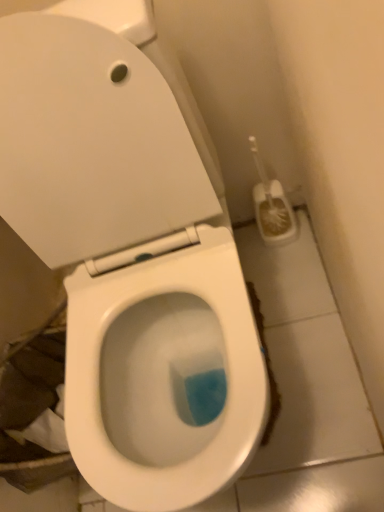
Question: In terms of height, does white plastic toilet brush at right look taller or shorter compared to white glossy toilet at center?

Choices:
 (A) tall
 (B) short

Answer: (B)

Question: From a real-world perspective, is white plastic toilet brush at right positioned above or below white glossy toilet at center?

Choices:
 (A) below
 (B) above

Answer: (A)

Question: Considering the positions of white plastic toilet brush at right and white glossy toilet at center in the image, is white plastic toilet brush at right wider or thinner than white glossy toilet at center?

Choices:
 (A) thin
 (B) wide

Answer: (A)

Question: From a real-world perspective, is white glossy toilet at center positioned above or below white plastic toilet brush at right?

Choices:
 (A) below
 (B) above

Answer: (B)

Question: In terms of height, does white glossy toilet at center look taller or shorter compared to white plastic toilet brush at right?

Choices:
 (A) tall
 (B) short

Answer: (A)

Question: Is point (72, 164) positioned closer to the camera than point (273, 233)?

Choices:
 (A) closer
 (B) farther

Answer: (A)

Question: From the image's perspective, is white glossy toilet at center positioned above or below white plastic toilet brush at right?

Choices:
 (A) above
 (B) below

Answer: (B)